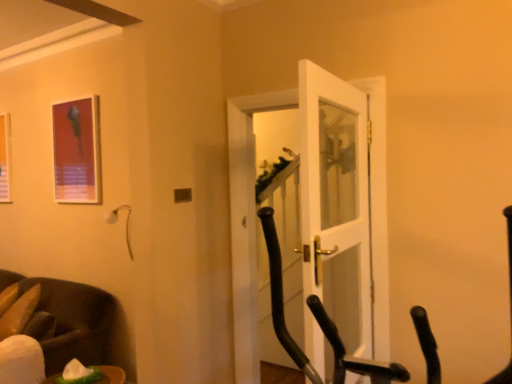
At what (x,y) coordinates should I click in order to perform the action: click on empty space that is ontop of metallic frame at upper left, placed as the second picture frame when sorted from left to right (from a real-world perspective). Please return your answer as a coordinate pair (x, y). Looking at the image, I should click on (73, 91).